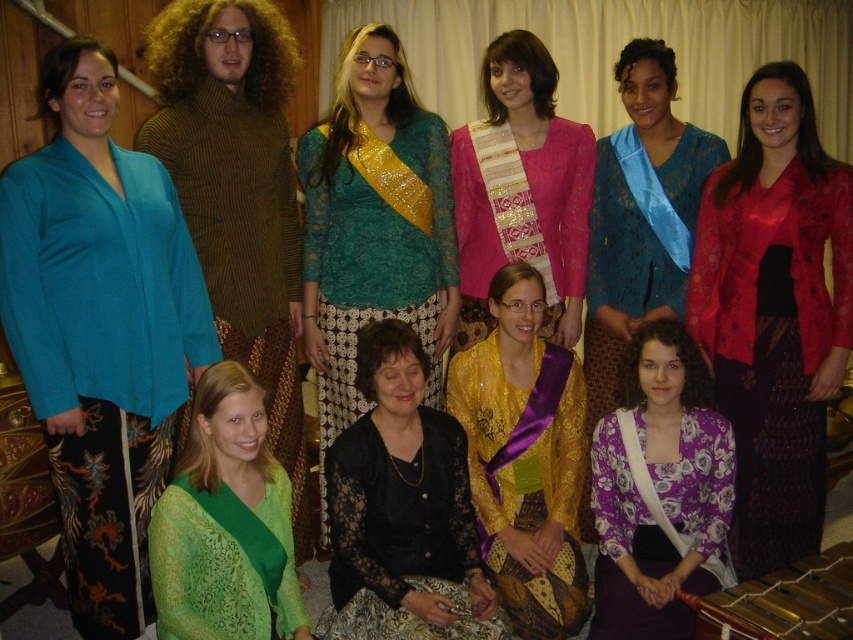
Question: In this image, where is teal silk blouse at left located relative to green lace blouse at lower left?

Choices:
 (A) left
 (B) right

Answer: (A)

Question: Is purple floral blouse at lower center positioned before matte blue dress at center?

Choices:
 (A) no
 (B) yes

Answer: (B)

Question: Which of these objects is positioned closest to the lace teal blouse at upper center?

Choices:
 (A) pink satin sash at center
 (B) satin red blouse at upper right
 (C) purple floral blouse at lower center
 (D) gold sequined blouse at center

Answer: (A)

Question: Which of the following is the farthest from the observer?

Choices:
 (A) (148, 432)
 (B) (587, 275)

Answer: (B)

Question: Which point is closer to the camera?

Choices:
 (A) (618, 369)
 (B) (537, 84)

Answer: (B)

Question: Is teal silk blouse at left positioned in front of green lace blouse at lower left?

Choices:
 (A) no
 (B) yes

Answer: (A)